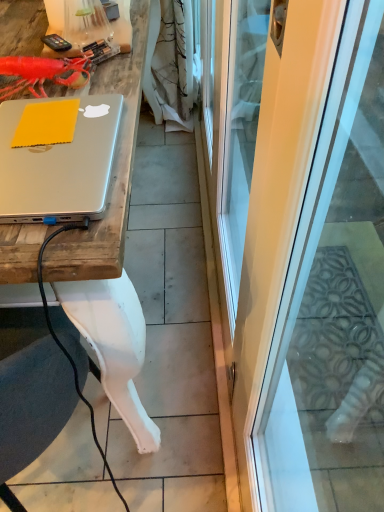
Identify the location of vacant area on top of matte silver laptop at upper left (from a real-world perspective). The image size is (384, 512). click(x=46, y=142).